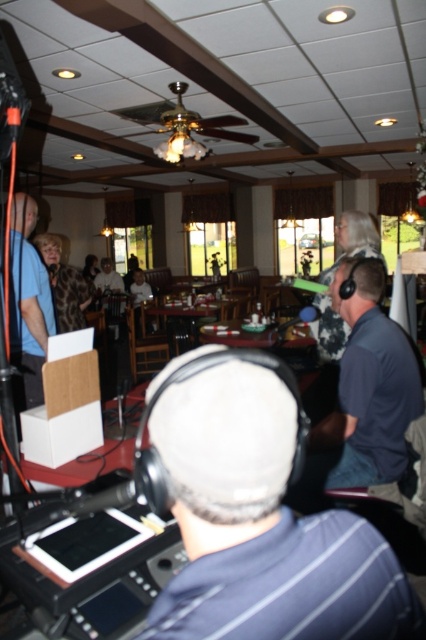
From the picture: You are organizing a small event in this room and need to place a new table. The table must be placed between the dark gray fabric headphones at center and the matte blue shirt at left. Considering their sizes, can the table fit in the space between them?

The dark gray fabric headphones at center occupies less space than matte blue shirt at left. Therefore, the space between them may be sufficient to place a table, but the exact dimensions of the table would determine if it fits.

You are a delivery person who needs to hand a package to the person wearing the dark blue shirt at center. The delivery robot you are using has a maximum reach of 6 feet. Can the robot deliver the package without moving closer?

The dark blue shirt at center is 5.97 feet away, so yes, the delivery robot can deliver the package without moving closer since the distance is within its 6 feet reach.

You are a photographer trying to capture a group photo of the dark blue shirt at center and the matte blue shirt at left. Since you want to ensure both shirts are fully visible in the frame, which shirt should you position closer to the edge of the frame to avoid cropping?

The dark blue shirt at center might be wider than matte blue shirt at left, so to avoid cropping, position the dark blue shirt at center closer to the edge of the frame since it is wider and requires more space.